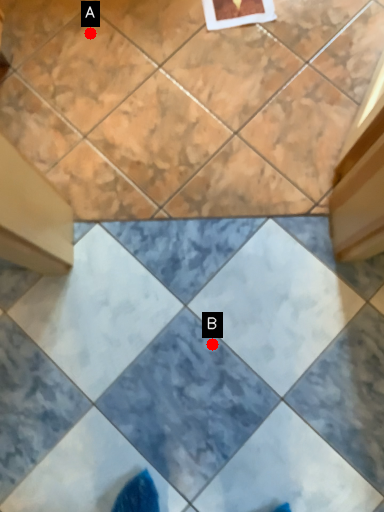
Question: Two points are circled on the image, labeled by A and B beside each circle. Which point is closer to the camera?

Choices:
 (A) A is closer
 (B) B is closer

Answer: (B)